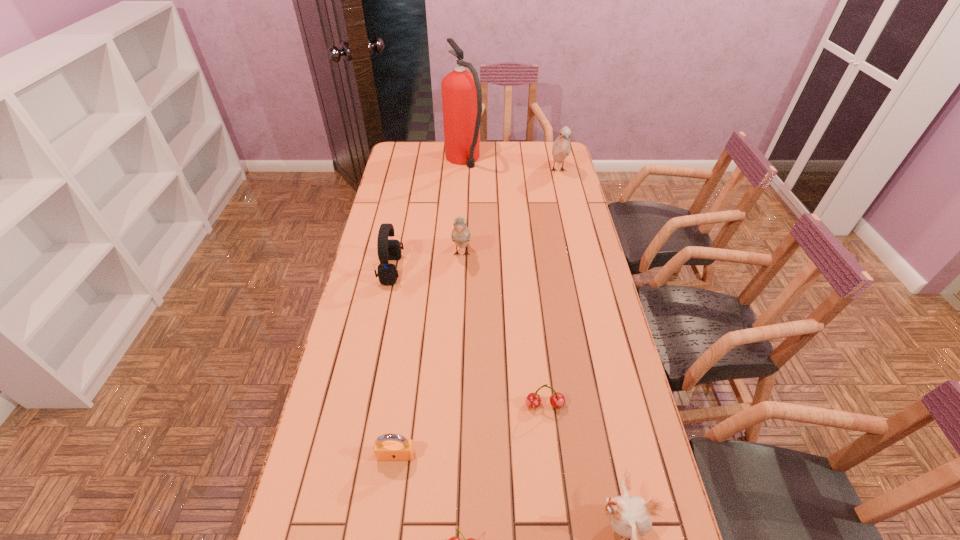
I want to click on object that is the second closest to the headset, so click(461, 91).

Locate which bird is the second closest to the third nearest object. Please provide its 2D coordinates. Your answer should be formatted as a tuple, i.e. [(x, y)], where the tuple contains the x and y coordinates of a point satisfying the conditions above.

[(460, 235)]

Select which bird appears as the third closest to the farther cherry. Please provide its 2D coordinates. Your answer should be formatted as a tuple, i.e. [(x, y)], where the tuple contains the x and y coordinates of a point satisfying the conditions above.

[(561, 148)]

Find the location of a particular element. This screenshot has height=540, width=960. free region that satisfies the following two spatial constraints: 1. at the beak of the farthest bird; 2. on the headband of the headset is located at coordinates (581, 269).